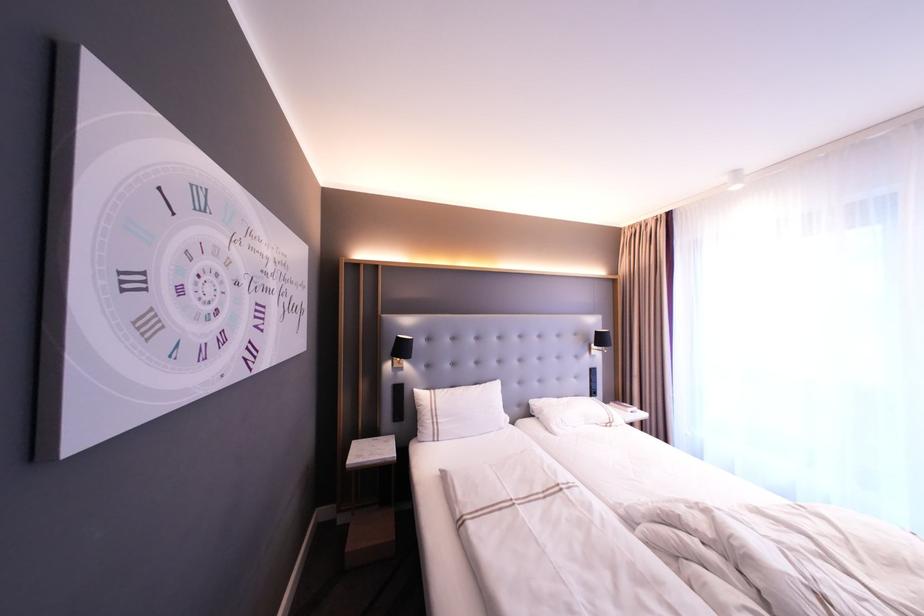
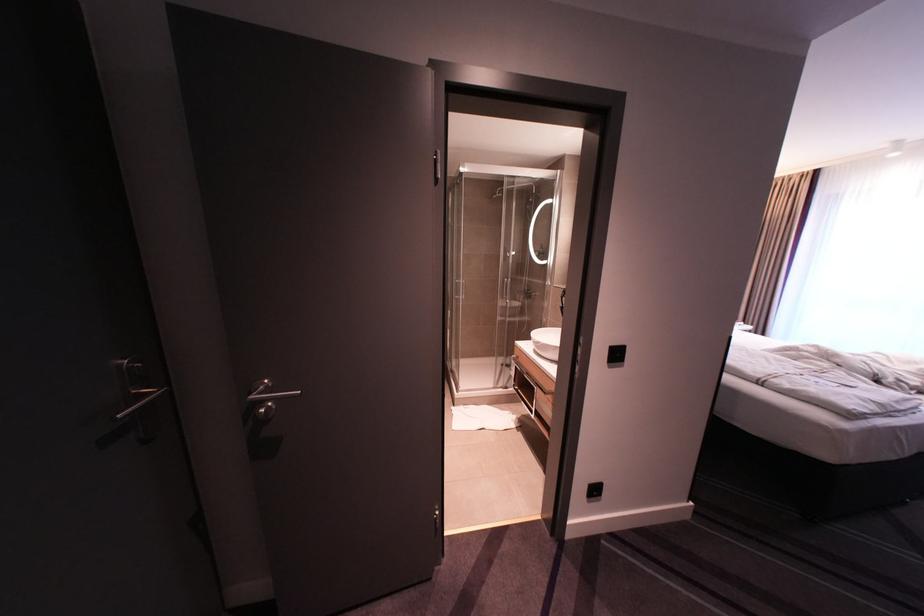
What movement of the cameraman would produce the second image?

The cameraman moved toward left, backward.